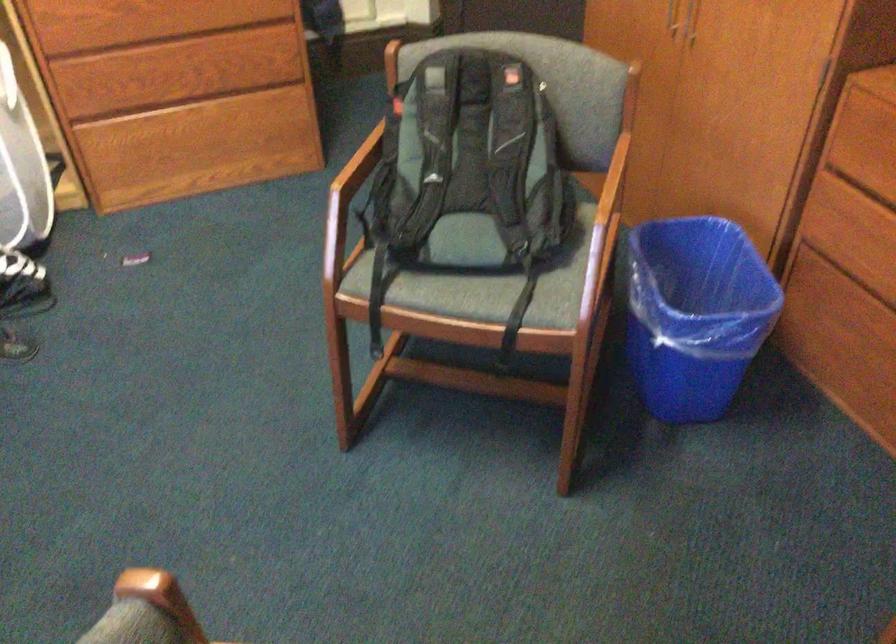
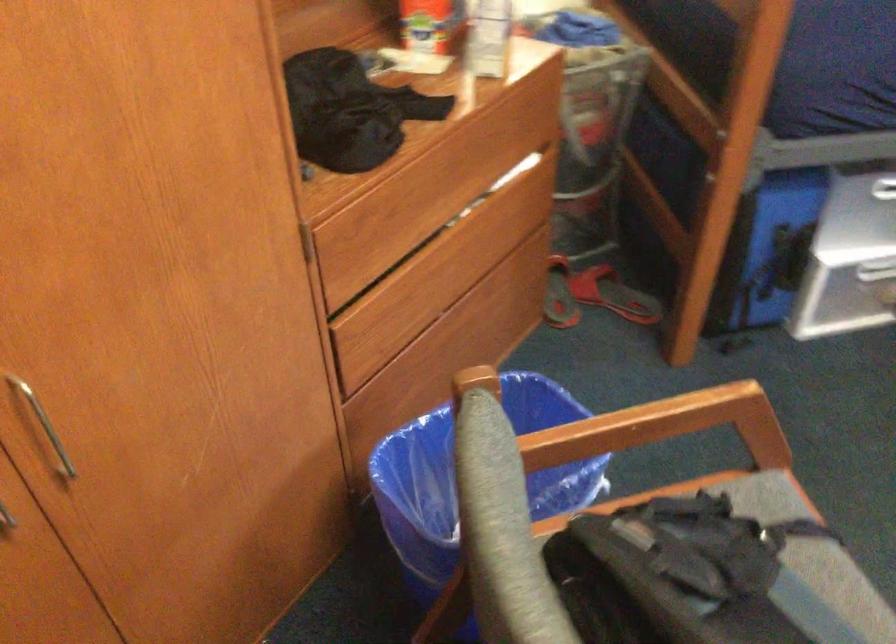
In the second image, find the point that corresponds to the point at 571,69 in the first image.

(471, 475)